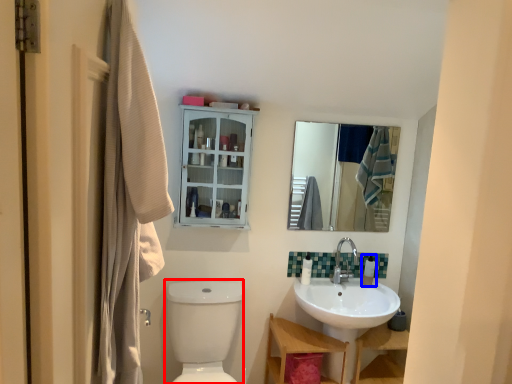
Question: Which of the following is the closest to the observer, toilet bowl (highlighted by a red box) or toiletry (highlighted by a blue box)?

Choices:
 (A) toilet bowl
 (B) toiletry

Answer: (A)